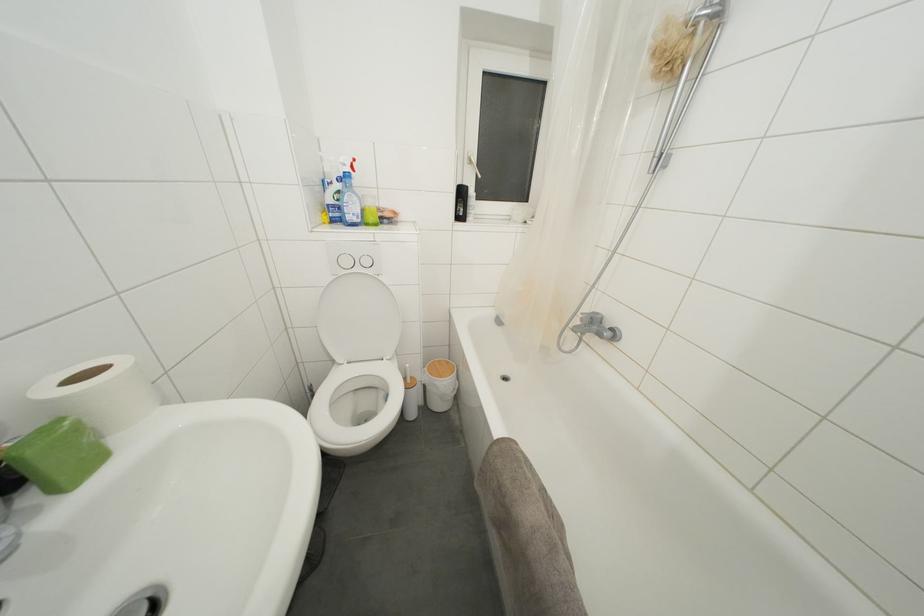
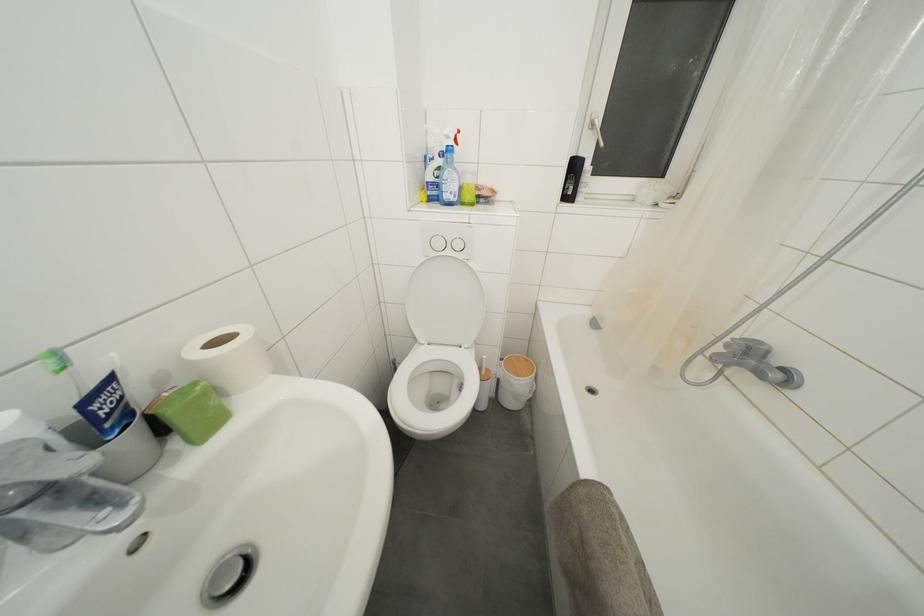
Find the pixel in the second image that matches point 412,386 in the first image.

(488, 378)